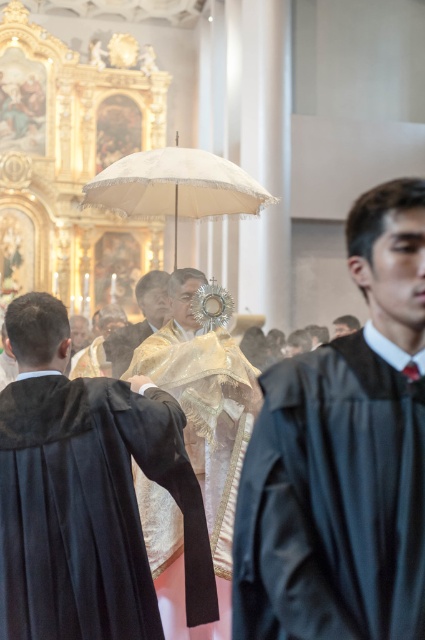
You are standing at the entrance of the church and see the solemn religious procession. There is a point marked at coordinates (343, 458). What object is located at that specific coordinate?

The smooth black robe at center is located at point (343, 458).

You are an observer standing at the back of the church watching the religious procession. You notice the shiny gold robe at center and the white lace umbrella at center. Which object is positioned higher in the image?

The shiny gold robe at center is taller than the white lace umbrella at center, so the shiny gold robe at center is positioned higher in the image.

You are an observer at the back of the church watching the religious procession. You notice two individuals at the center wearing the smooth black robe at center and the shiny gold robe at center. Which one appears shorter in height?

The smooth black robe at center is not as tall as the shiny gold robe at center, so the individual wearing the smooth black robe at center appears shorter.